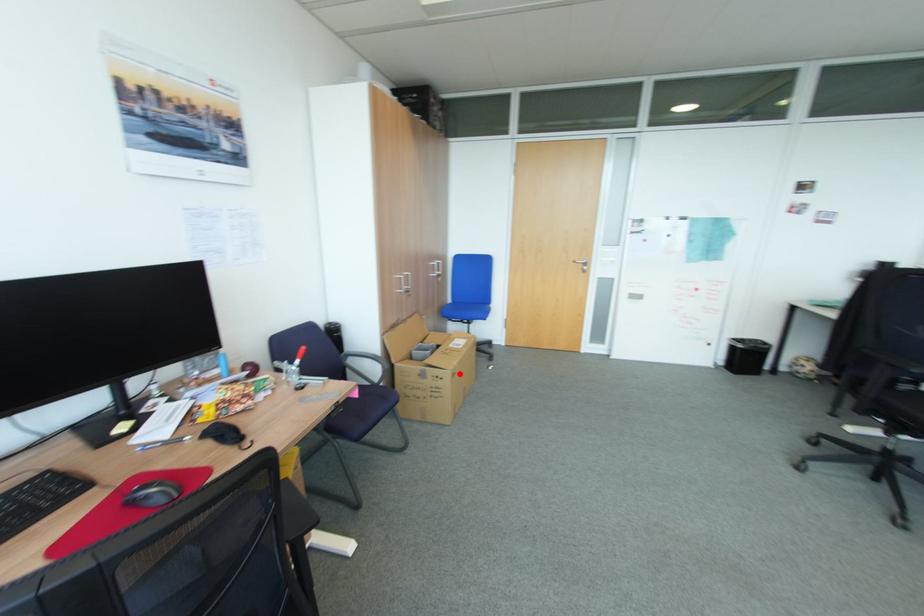
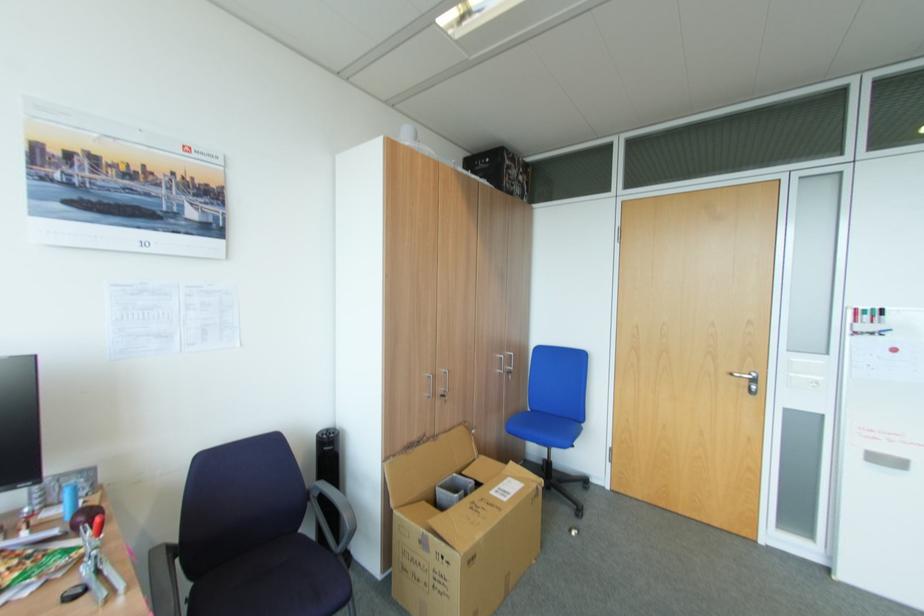
Question: I am providing you with two images of the same scene from different viewpoints. A red point is marked on the first image. Can you still see the location of the red point in image 2?

Choices:
 (A) Yes
 (B) No

Answer: (A)